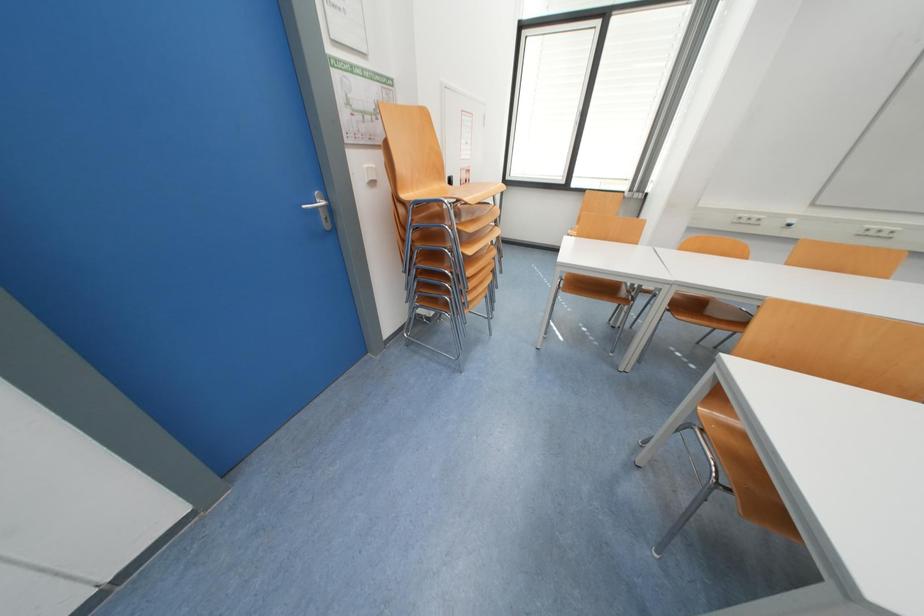
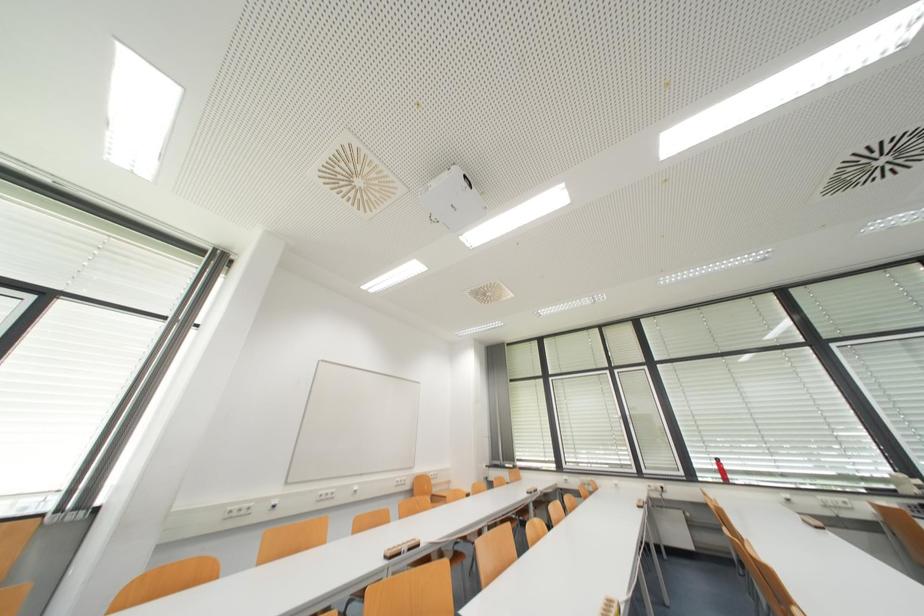
The images are taken continuously from a first-person perspective. In which direction is your viewpoint rotating?

The camera's rotation is toward right-up.